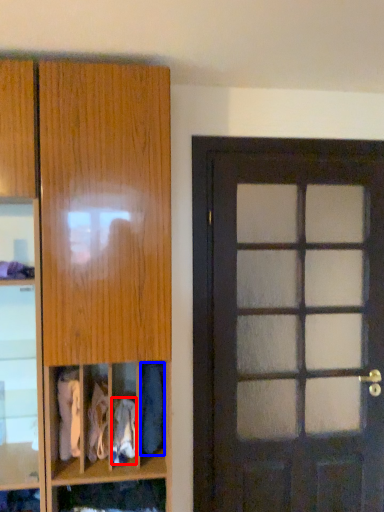
Question: Which object is further to the camera taking this photo, clothing (highlighted by a red box) or clothing (highlighted by a blue box)?

Choices:
 (A) clothing
 (B) clothing

Answer: (B)